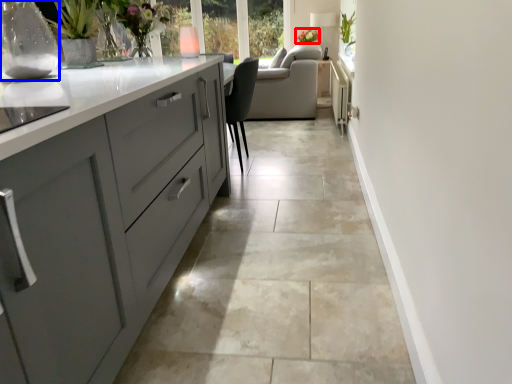
Question: Which object is closer to the camera taking this photo, floral arrangement (highlighted by a red box) or glass vase (highlighted by a blue box)?

Choices:
 (A) floral arrangement
 (B) glass vase

Answer: (B)